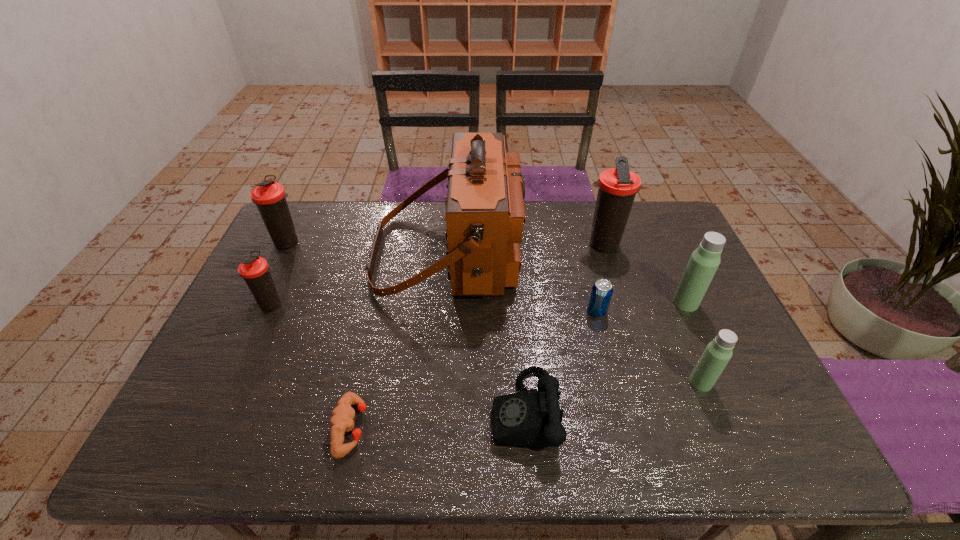
Where is `vacant position in the image that satisfies the following two spatial constraints: 1. on the front side of the beer can; 2. on the right side of the second smallest brown thermos bottle`? This screenshot has height=540, width=960. vacant position in the image that satisfies the following two spatial constraints: 1. on the front side of the beer can; 2. on the right side of the second smallest brown thermos bottle is located at coordinates (254, 312).

This screenshot has width=960, height=540. What are the coordinates of `free point that satisfies the following two spatial constraints: 1. on the face side of the tallest object; 2. on the right side of the farther light thermos bottle` in the screenshot? It's located at (444, 303).

Locate an element on the screen. Image resolution: width=960 pixels, height=540 pixels. vacant area that satisfies the following two spatial constraints: 1. on the front side of the bigger light thermos bottle; 2. on the left side of the second biggest brown thermos bottle is located at coordinates (258, 303).